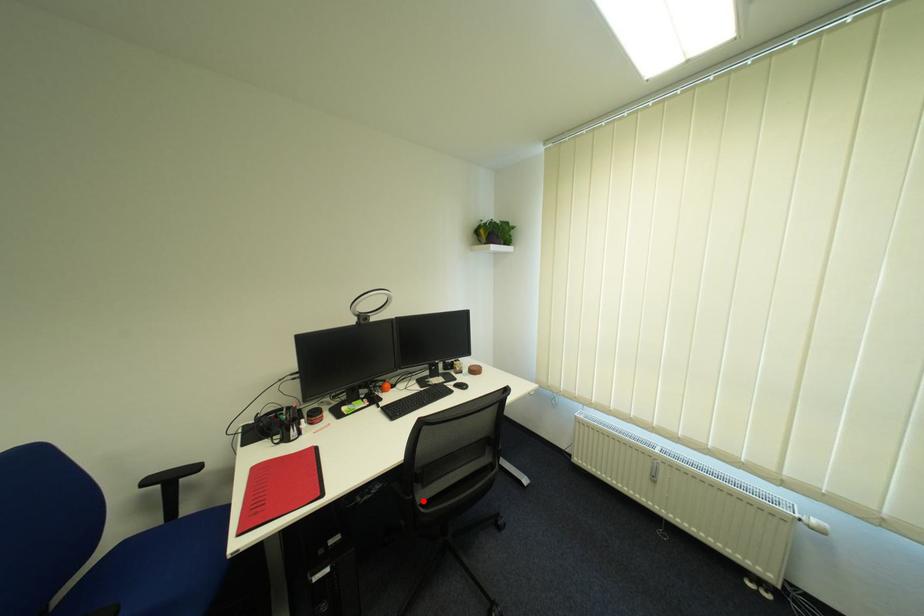
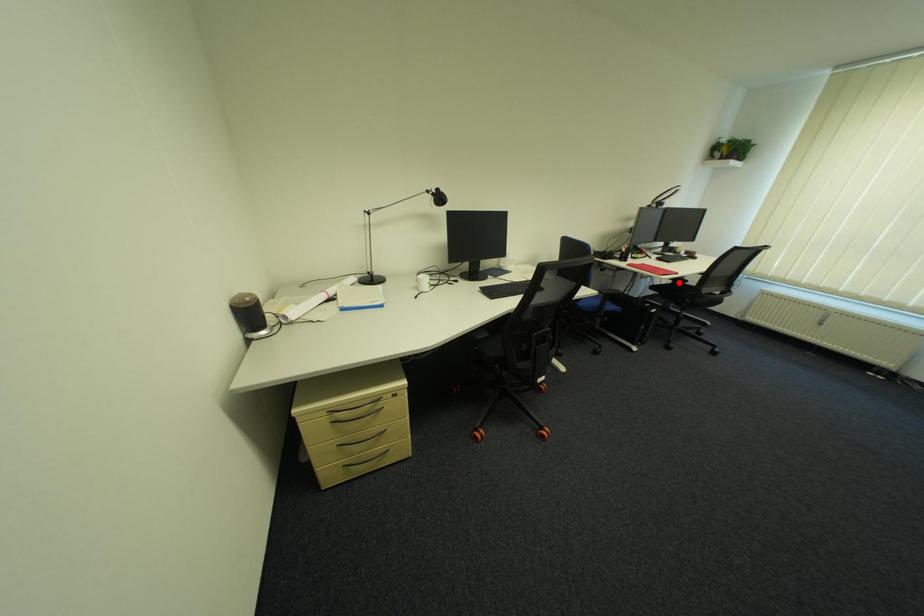
I am providing you with two images of the same scene from different viewpoints. A red point is marked on the first image and another point is marked on the second image. Is the marked point in image1 the same physical position as the marked point in image2?

No